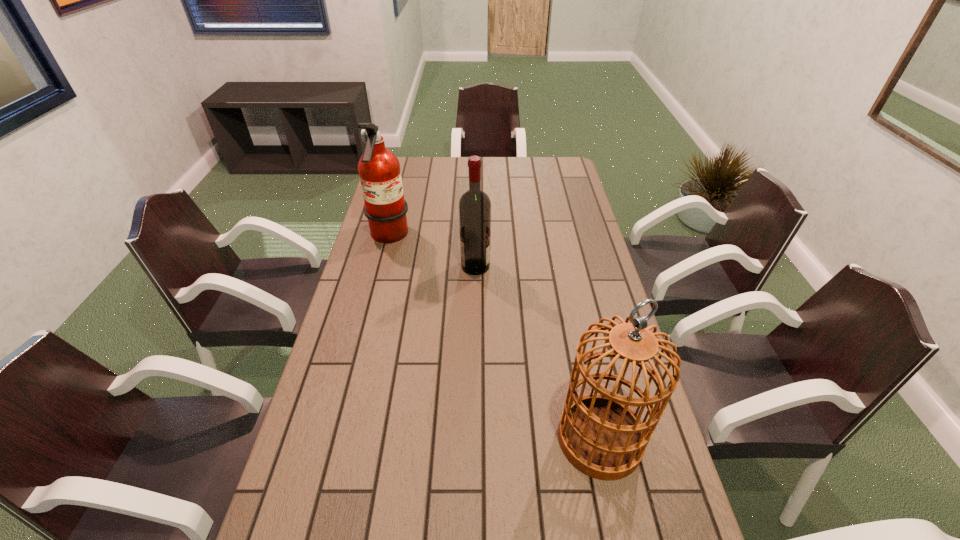
Where is `the leftmost object`? the leftmost object is located at coordinates [379, 170].

Image resolution: width=960 pixels, height=540 pixels. Find the location of `the nearest object`. the nearest object is located at coordinates click(x=600, y=435).

In order to click on the rightmost object in this screenshot , I will do `click(600, 435)`.

Where is `alcohol`? This screenshot has height=540, width=960. alcohol is located at coordinates (474, 205).

Find the location of a particular element. Image resolution: width=960 pixels, height=540 pixels. vacant space situated on the nozzle and handle of the leftmost object is located at coordinates (431, 237).

Identify the location of free space located on the left of the nearest object. The image size is (960, 540). pyautogui.click(x=503, y=439).

Where is `blank area located 0.110m on the front and back of the second object from left to right`? The width and height of the screenshot is (960, 540). blank area located 0.110m on the front and back of the second object from left to right is located at coordinates tap(522, 266).

Find the location of a particular element. The width and height of the screenshot is (960, 540). object positioned at the left edge is located at coordinates (379, 170).

The width and height of the screenshot is (960, 540). I want to click on object at the right edge, so click(x=600, y=435).

What are the coordinates of `vacant space at the far edge of the desktop` in the screenshot? It's located at (530, 159).